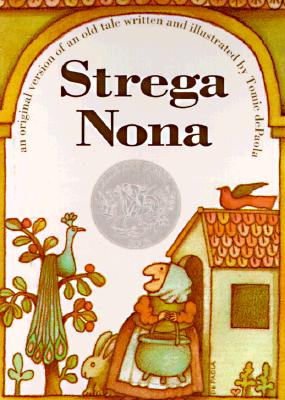
The width and height of the screenshot is (285, 400). I want to click on handle, so click(177, 327).